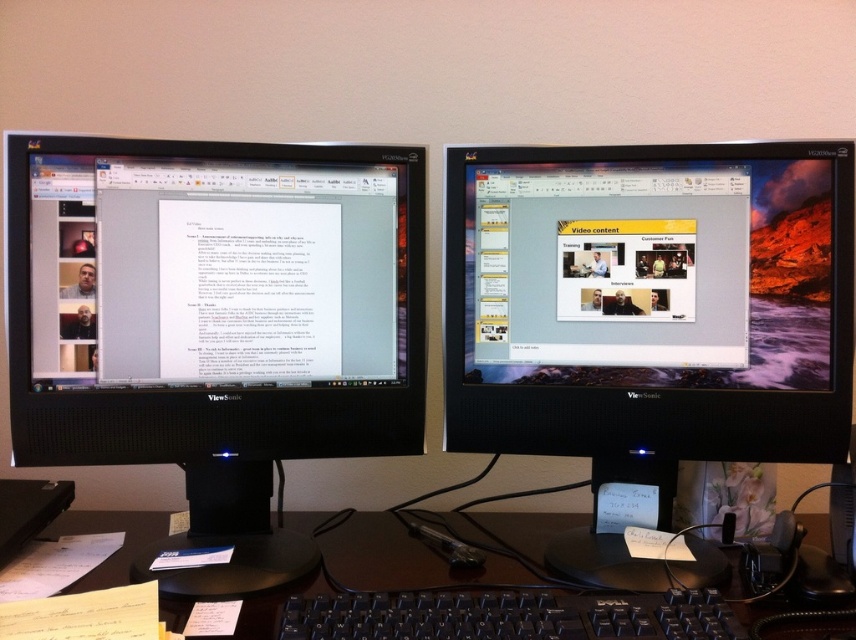
You have a USB cable that is 10 inches long. You need to connect a device to both the black glossy monitor at left and the black glossy monitor at center. Is the cable long enough to reach both monitors without any extension?

The distance between the black glossy monitor at left and the black glossy monitor at center is 9.88 inches. Since the USB cable is 10 inches long, it is slightly longer than the distance between them. Therefore, the cable should be sufficient to reach both monitors without needing an extension.

You are setting up a dual monitor system and want to place the black glossy monitor at left and the black glossy monitor at center on your desk. According to the image, which monitor should be placed higher on the desk?

The black glossy monitor at left should be placed higher on the desk because it is located above the black glossy monitor at center in the image.

You are a remote worker who needs to reach the black plastic keyboard at center without moving your chair. Can you comfortably reach it from the black glossy monitor at center?

The black glossy monitor at center is 25.91 centimeters away from the black plastic keyboard at center. A typical comfortable keyboard reach for an adult is around 50 centimeters, so you can comfortably reach the black plastic keyboard at center from the black glossy monitor at center.